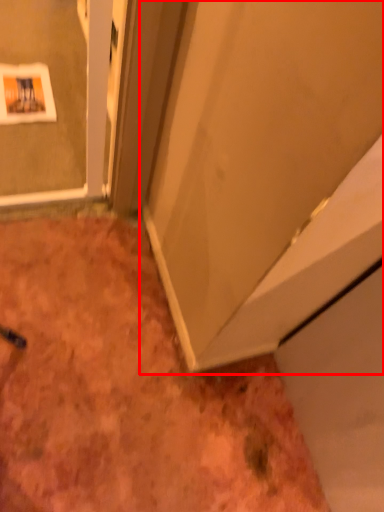
Question: From the image's perspective, what is the correct spatial relationship of door (annotated by the red box) in relation to dirt?

Choices:
 (A) below
 (B) above

Answer: (B)